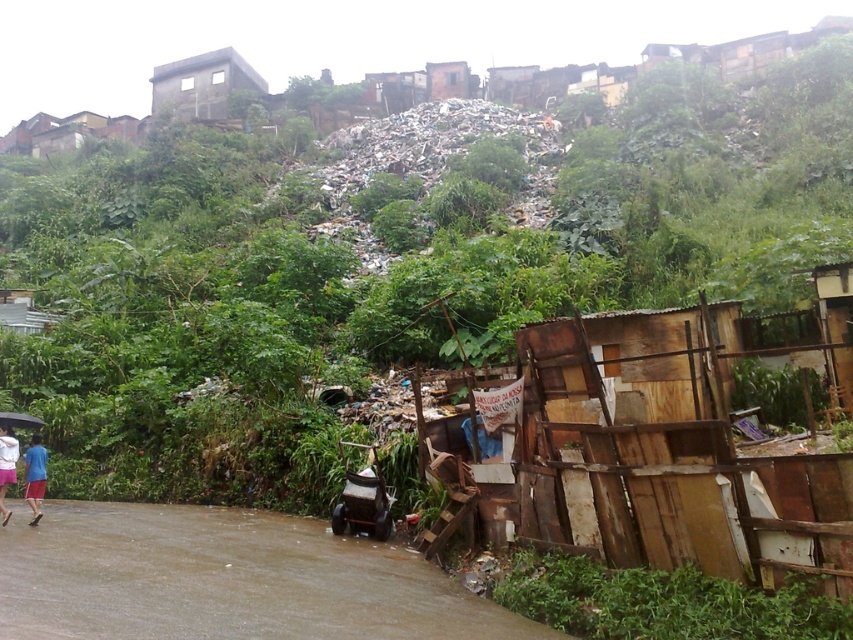
Question: Estimate the real-world distances between objects in this image. Which object is farther from the brown muddy flood at lower left?

Choices:
 (A) gray concrete building at upper center
 (B) transparent plastic umbrella at lower left

Answer: (A)

Question: Is brown muddy flood at lower left to the right of gray concrete building at upper center from the viewer's perspective?

Choices:
 (A) yes
 (B) no

Answer: (A)

Question: Which point is closer to the camera taking this photo?

Choices:
 (A) (1, 522)
 (B) (27, 413)
 (C) (459, 628)

Answer: (C)

Question: Does gray concrete building at upper center have a larger size compared to brown corrugated metal hut at upper center?

Choices:
 (A) no
 (B) yes

Answer: (B)

Question: Which of the following is the farthest from the observer?

Choices:
 (A) (22, 417)
 (B) (3, 496)
 (C) (407, 611)
 (D) (32, 502)

Answer: (A)

Question: Does brown muddy flood at lower left lie behind transparent plastic umbrella at lower left?

Choices:
 (A) no
 (B) yes

Answer: (A)